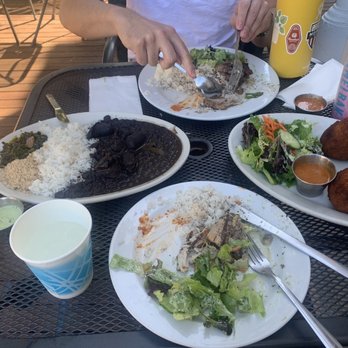
Where is `cups`? Image resolution: width=348 pixels, height=348 pixels. cups is located at coordinates (79, 263).